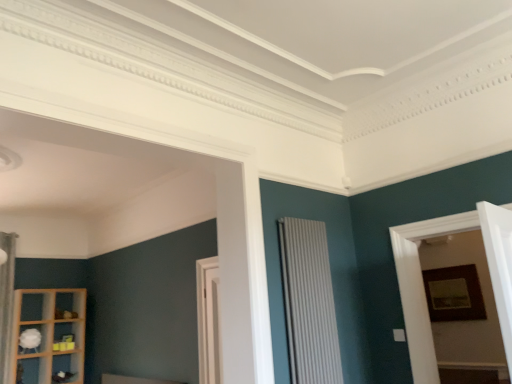
Question: Based on their sizes in the image, would you say wooden framed picture at right is bigger or smaller than wooden shelf at lower left, the first shelf when ordered from bottom to top?

Choices:
 (A) small
 (B) big

Answer: (A)

Question: Is wooden framed picture at right inside the boundaries of wooden shelf at lower left, the second shelf when ordered from top to bottom, or outside?

Choices:
 (A) inside
 (B) outside

Answer: (B)

Question: Which of these objects is positioned farthest from the white fabric curtain at left?

Choices:
 (A) white wood door at center
 (B) white textured radiator at center
 (C) wooden framed picture at right
 (D) wooden picture frame at right
 (E) white matte shelf at lower left, which appears as the first shelf when viewed from the top

Answer: (D)

Question: Which of these objects is positioned closest to the white textured radiator at center?

Choices:
 (A) wooden shelf at lower left, the first shelf when ordered from bottom to top
 (B) white fabric curtain at left
 (C) white matte shelf at lower left, acting as the second shelf starting from the bottom
 (D) wooden framed picture at right
 (E) wooden picture frame at right

Answer: (D)